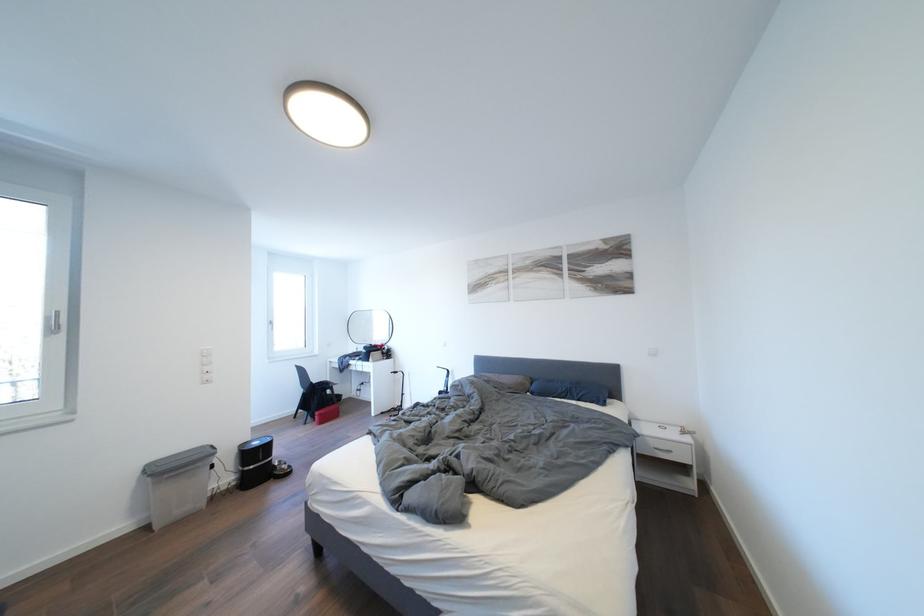
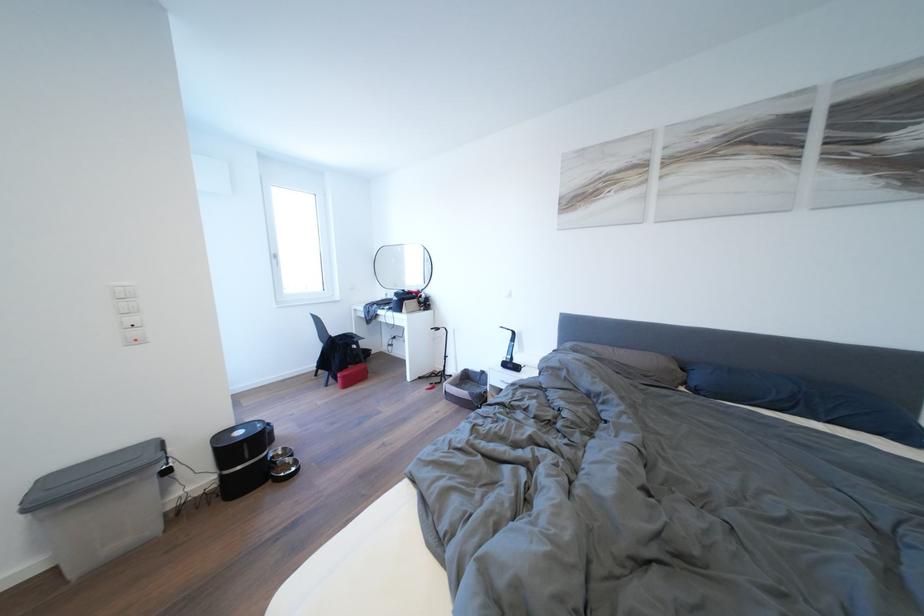
Where in the second image is the point corresponding to pixel 325 415 from the first image?

(348, 376)